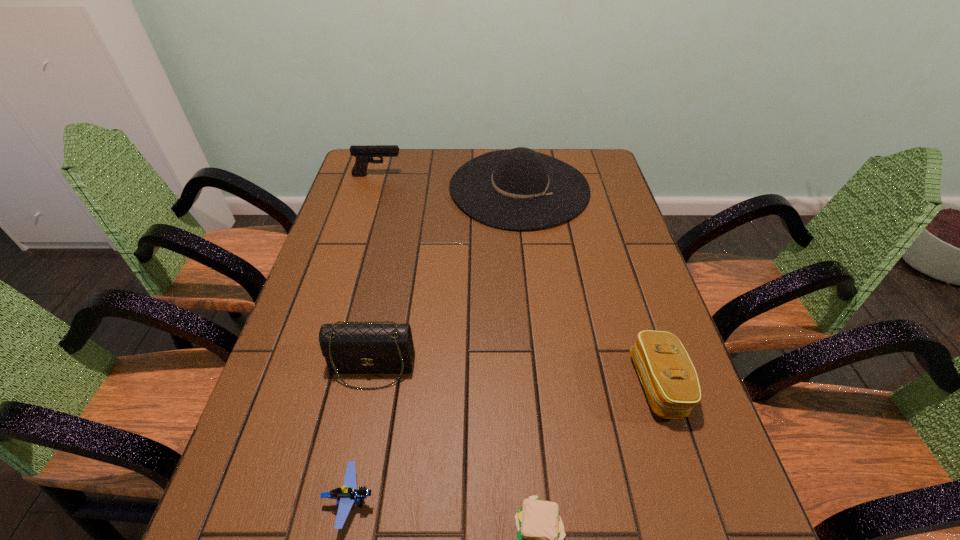
At what (x,y) coordinates should I click in order to perform the action: click on sombrero. Please return your answer as a coordinate pair (x, y). This screenshot has height=540, width=960. Looking at the image, I should click on (516, 189).

This screenshot has height=540, width=960. Identify the location of the taller clutch bag. (348, 348).

Identify the location of pistol. The image size is (960, 540). (362, 153).

In order to click on the shorter clutch bag in this screenshot , I will do `click(668, 376)`.

I want to click on the fourth tallest object, so click(x=668, y=376).

Where is `the fifth tallest object`? The image size is (960, 540). the fifth tallest object is located at coordinates (348, 494).

This screenshot has width=960, height=540. I want to click on vacant position located 0.260m on the front-facing side of the sombrero, so click(x=532, y=296).

The width and height of the screenshot is (960, 540). In order to click on free spot located 0.270m on the front flap of the taller clutch bag in this screenshot , I will do `click(340, 530)`.

You are a GUI agent. You are given a task and a screenshot of the screen. Output one action in this format:
    pyautogui.click(x=<x>, y=<y>)
    Task: Click on the vacant space situated on the front-facing side of the pistol
    The image size is (960, 540).
    Given the screenshot: What is the action you would take?
    417,176

Where is `free space located on the zipper side of the fourth tallest object`? free space located on the zipper side of the fourth tallest object is located at coordinates (602, 384).